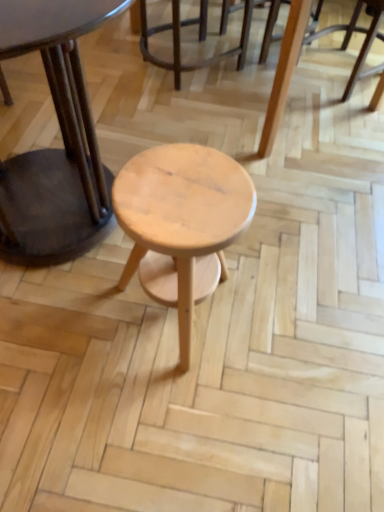
Question: Is light brown wood chair at center further to the viewer compared to matte black table at center?

Choices:
 (A) yes
 (B) no

Answer: (A)

Question: Could matte black table at center be considered to be inside light brown wood chair at center?

Choices:
 (A) yes
 (B) no

Answer: (B)

Question: Is light brown wood chair at center taller than matte black table at center?

Choices:
 (A) yes
 (B) no

Answer: (B)

Question: From a real-world perspective, is light brown wood chair at center located beneath matte black table at center?

Choices:
 (A) yes
 (B) no

Answer: (A)

Question: Considering the relative sizes of light brown wood chair at center and matte black table at center in the image provided, is light brown wood chair at center wider than matte black table at center?

Choices:
 (A) no
 (B) yes

Answer: (A)

Question: Is light brown wood chair at center bigger than matte black table at center?

Choices:
 (A) no
 (B) yes

Answer: (A)

Question: Considering the relative sizes of natural wood stool at center and matte black table at center in the image provided, is natural wood stool at center bigger than matte black table at center?

Choices:
 (A) no
 (B) yes

Answer: (A)

Question: From the image's perspective, does natural wood stool at center appear higher than matte black table at center?

Choices:
 (A) no
 (B) yes

Answer: (A)

Question: Does natural wood stool at center have a lesser height compared to matte black table at center?

Choices:
 (A) yes
 (B) no

Answer: (A)

Question: From a real-world perspective, is natural wood stool at center positioned over matte black table at center based on gravity?

Choices:
 (A) no
 (B) yes

Answer: (A)

Question: Is natural wood stool at center positioned with its back to matte black table at center?

Choices:
 (A) no
 (B) yes

Answer: (A)

Question: Is natural wood stool at center far from matte black table at center?

Choices:
 (A) yes
 (B) no

Answer: (B)

Question: Would you consider light brown wood chair at center to be distant from natural wood stool at center?

Choices:
 (A) no
 (B) yes

Answer: (B)